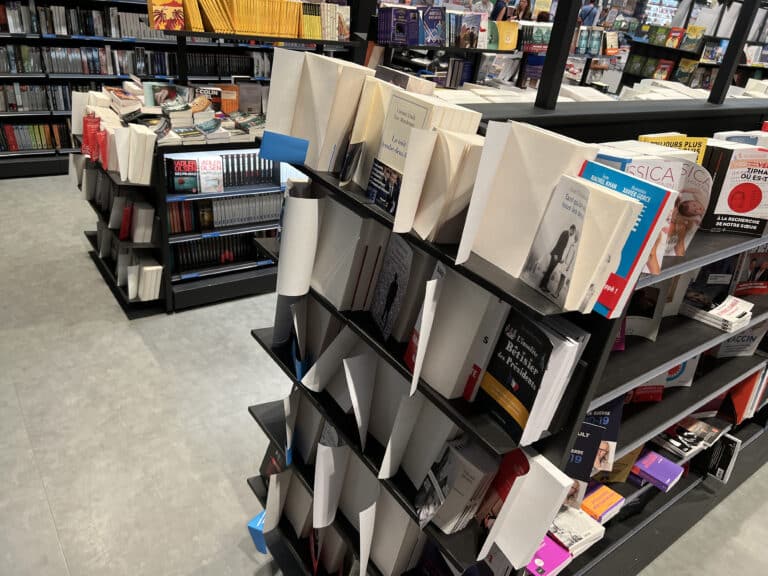
The height and width of the screenshot is (576, 768). I want to click on gray and white tile, so click(x=51, y=395).